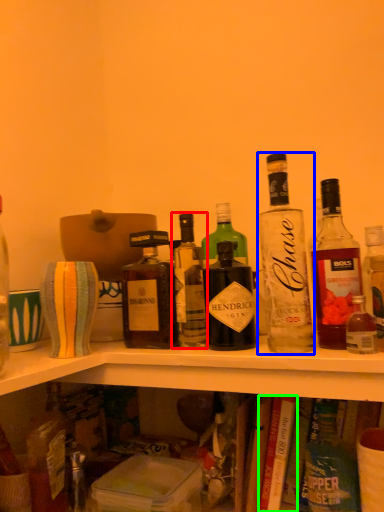
Question: Which is nearer to the bottle (highlighted by a red box)? bottle (highlighted by a blue box) or book (highlighted by a green box).

Choices:
 (A) bottle
 (B) book

Answer: (A)